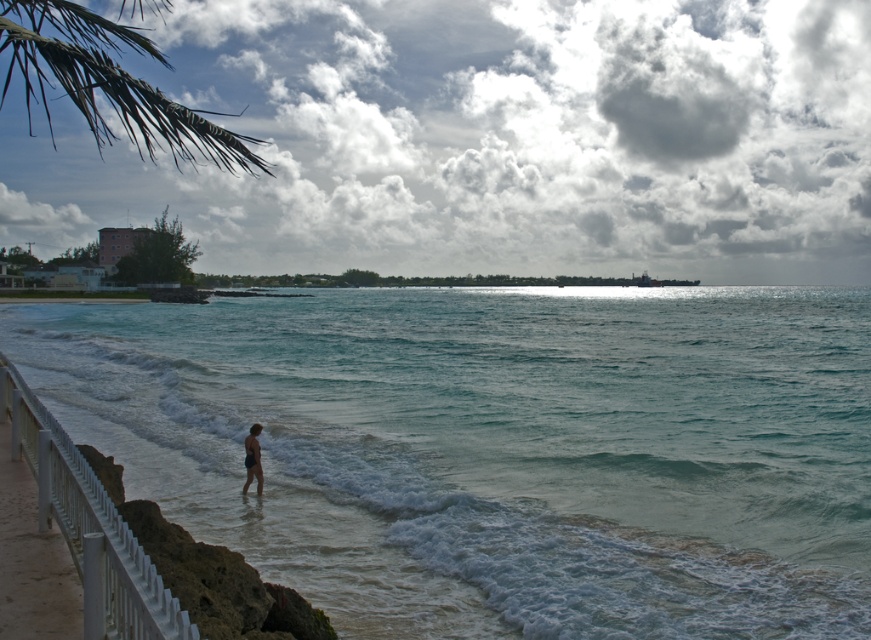
You are standing on the beach and want to walk to the clear blue water at center without getting your feet wet. The matte black swimwear at lower center is in your path. Can you step around it to reach the water?

The clear blue water at center is wider than the matte black swimwear at lower center, so you can step around the matte black swimwear at lower center to reach the water.

You are a photographer planning to capture the clear blue water at center and the white glossy rail at lower left in a single shot. Based on the scene, which object will occupy more of the frame?

The clear blue water at center occupies more of the frame since it is bigger than the white glossy rail at lower left according to the description.

Based on the photo, you are standing on the beach and want to take a photo of the green leafy palm at upper left. Which direction should you face to ensure it is in the frame?

The green leafy palm at upper left is located at point (x=107, y=83), which is towards the upper left corner of the image. To capture it in your photo, you should face the upper left direction.